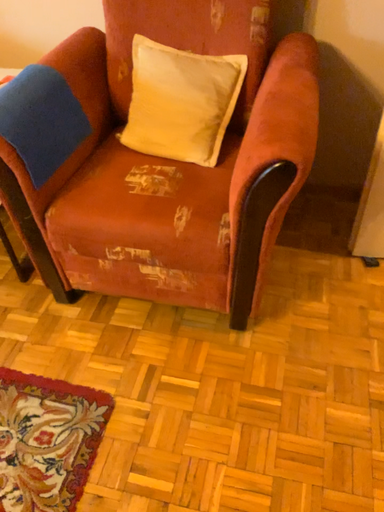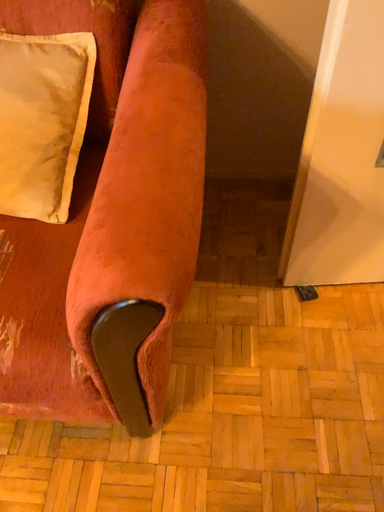
Question: Which way did the camera rotate in the video?

Choices:
 (A) rotated upward
 (B) rotated downward

Answer: (B)